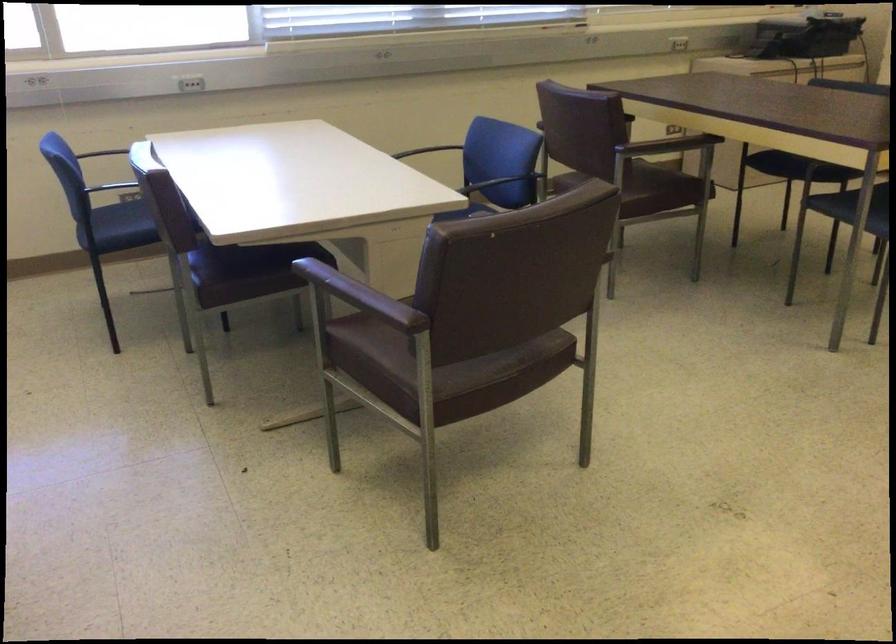
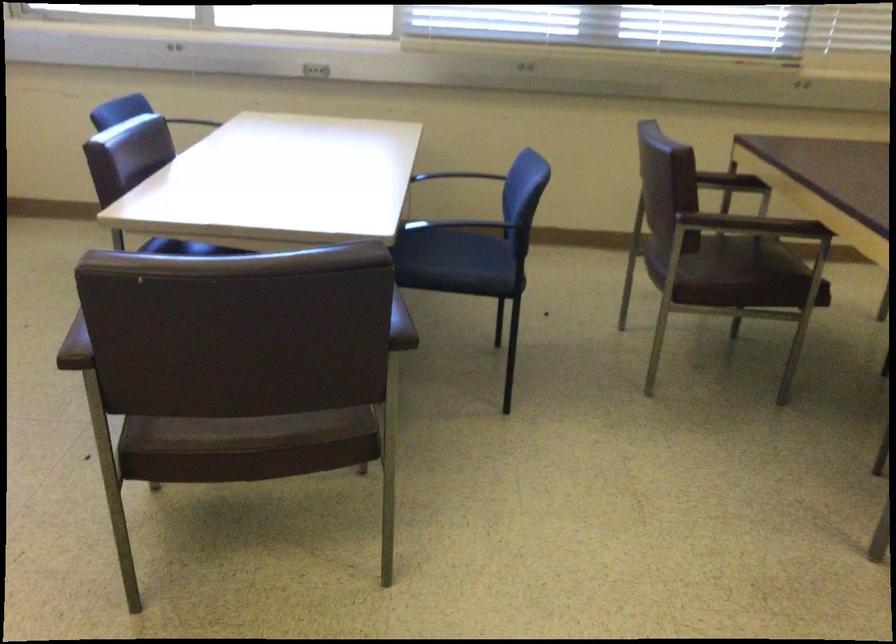
Find the pixel in the second image that matches point (391, 315) in the first image.

(75, 346)